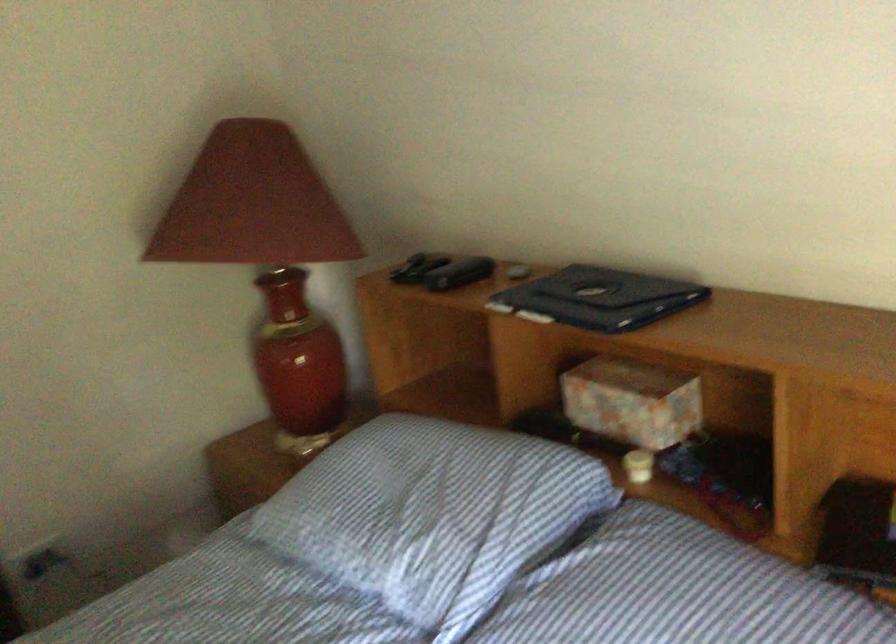
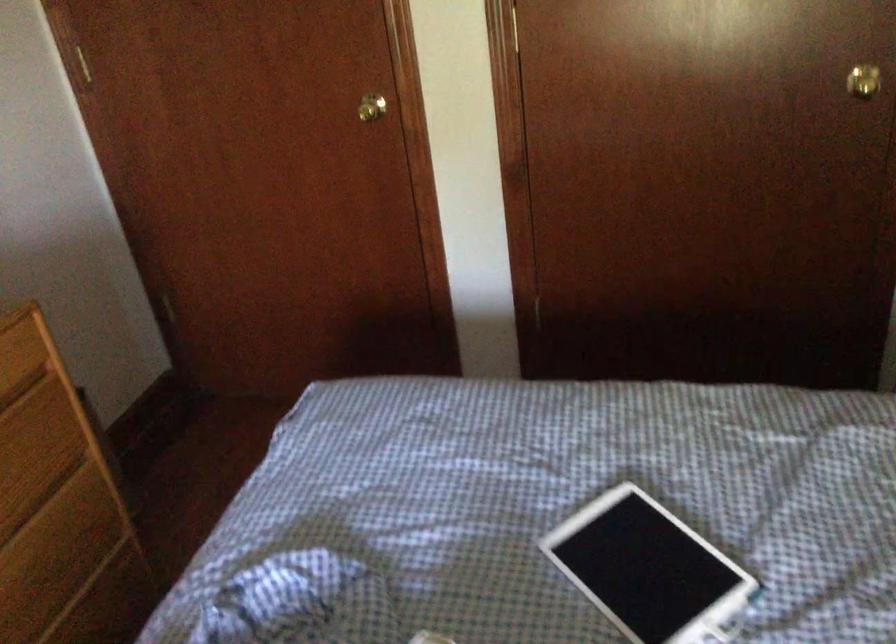
How did the camera likely rotate?

The rotation direction of the camera is left-down.